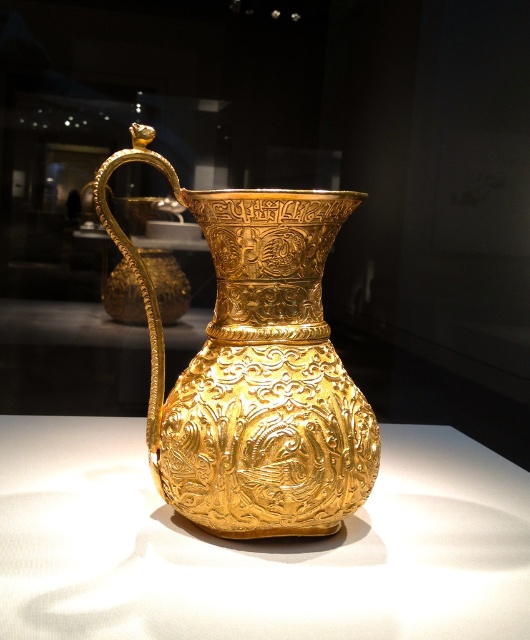
Question: Where is polished gold vase at center located in relation to gold textured jug at center in the image?

Choices:
 (A) above
 (B) below

Answer: (B)

Question: Which object is closer to the camera taking this photo?

Choices:
 (A) gold textured jug at center
 (B) polished gold vase at center

Answer: (B)

Question: Can you confirm if polished gold vase at center is positioned below gold textured jug at center?

Choices:
 (A) no
 (B) yes

Answer: (B)

Question: Considering the relative positions of polished gold vase at center and gold textured jug at center in the image provided, where is polished gold vase at center located with respect to gold textured jug at center?

Choices:
 (A) right
 (B) left

Answer: (B)

Question: Which object is farther from the camera taking this photo?

Choices:
 (A) gold textured jug at center
 (B) polished gold vase at center

Answer: (A)